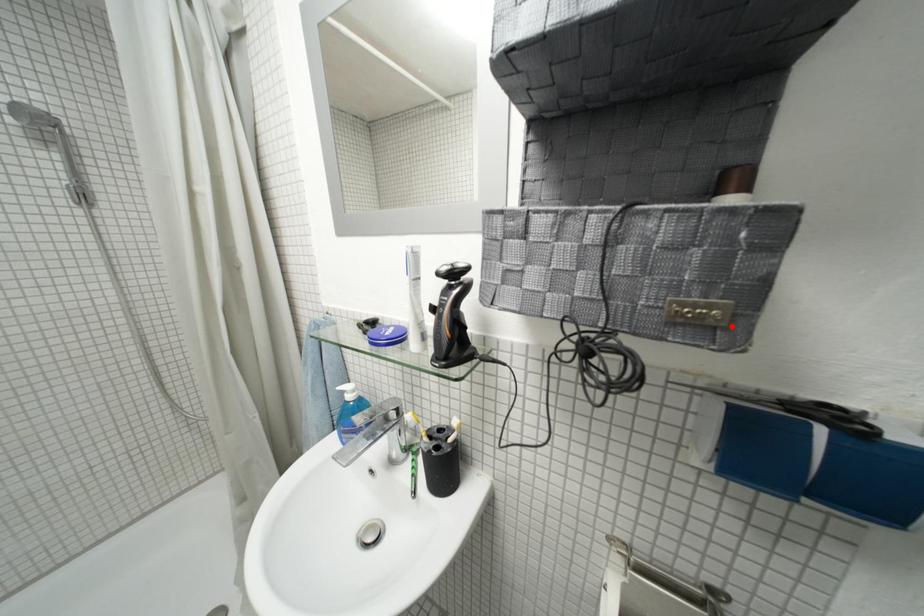
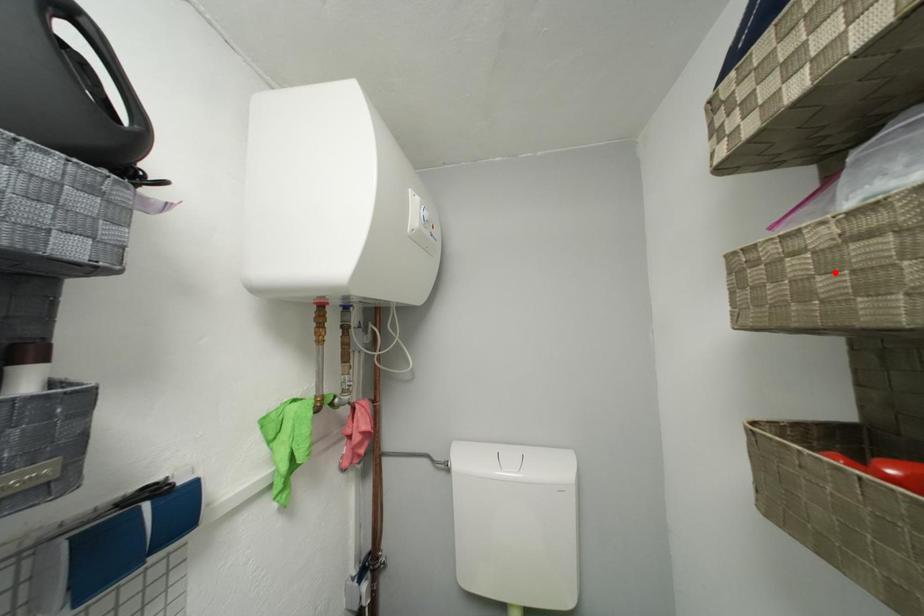
I am providing you with two images of the same scene from different viewpoints. A red point is marked on the first image and another point is marked on the second image. Is the marked point in image1 the same physical position as the marked point in image2?

No